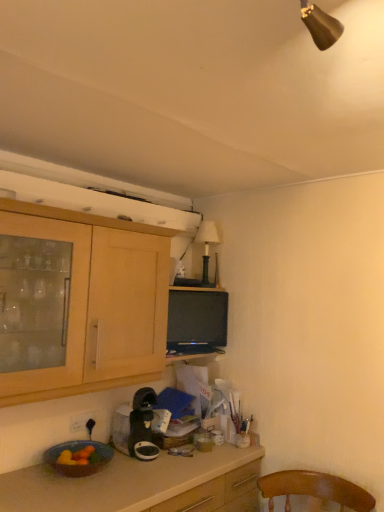
Question: Is black plastic coffee maker at lower center closer to the viewer compared to matte black tv at center?

Choices:
 (A) yes
 (B) no

Answer: (A)

Question: From a real-world perspective, is black plastic coffee maker at lower center on top of matte black tv at center?

Choices:
 (A) no
 (B) yes

Answer: (A)

Question: Can you confirm if black plastic coffee maker at lower center is positioned to the left of matte black tv at center?

Choices:
 (A) no
 (B) yes

Answer: (B)

Question: Is black plastic coffee maker at lower center bigger than matte black tv at center?

Choices:
 (A) yes
 (B) no

Answer: (A)

Question: Is black plastic coffee maker at lower center shorter than matte black tv at center?

Choices:
 (A) no
 (B) yes

Answer: (B)

Question: Does black plastic coffee maker at lower center have a lesser width compared to matte black tv at center?

Choices:
 (A) no
 (B) yes

Answer: (A)

Question: Is the position of black plastic coffee maker at lower center less distant than that of green matte lamp at upper center?

Choices:
 (A) no
 (B) yes

Answer: (B)

Question: Is black plastic coffee maker at lower center smaller than green matte lamp at upper center?

Choices:
 (A) no
 (B) yes

Answer: (A)

Question: Is black plastic coffee maker at lower center not close to green matte lamp at upper center?

Choices:
 (A) yes
 (B) no

Answer: (B)

Question: Is black plastic coffee maker at lower center facing away from green matte lamp at upper center?

Choices:
 (A) yes
 (B) no

Answer: (B)

Question: Can you confirm if black plastic coffee maker at lower center is wider than green matte lamp at upper center?

Choices:
 (A) yes
 (B) no

Answer: (A)

Question: Is the depth of black plastic coffee maker at lower center greater than that of green matte lamp at upper center?

Choices:
 (A) no
 (B) yes

Answer: (A)

Question: Considering the relative positions of white plastic power outlet at lower left and matte ceramic bowl at lower left in the image provided, is white plastic power outlet at lower left to the right of matte ceramic bowl at lower left from the viewer's perspective?

Choices:
 (A) no
 (B) yes

Answer: (A)